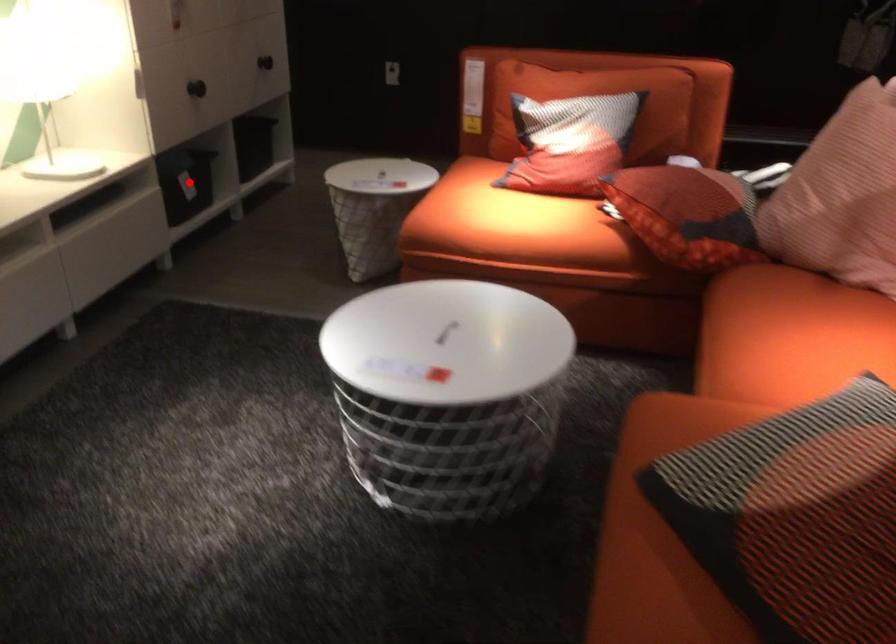
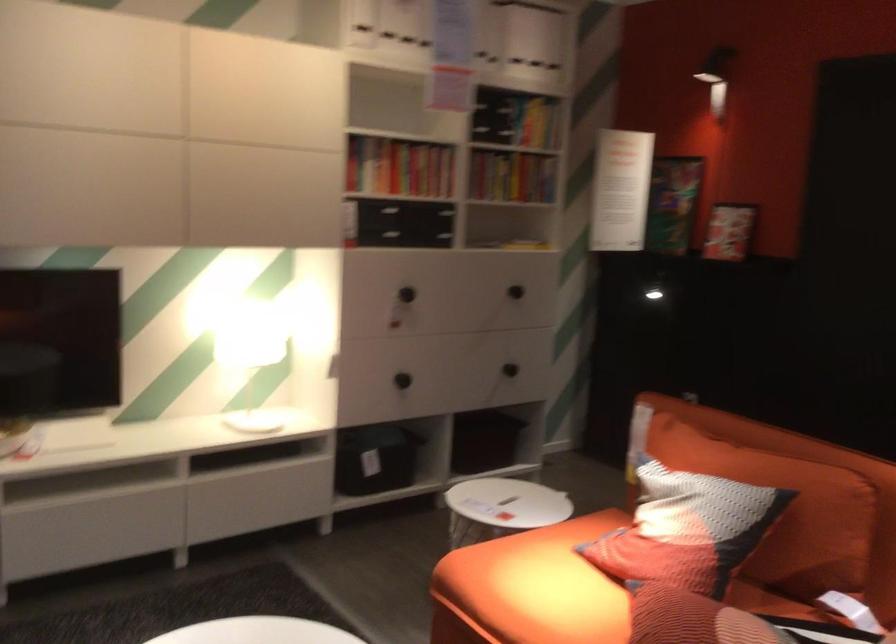
Where in the second image is the point corresponding to the highlighted location from the first image?

(375, 459)